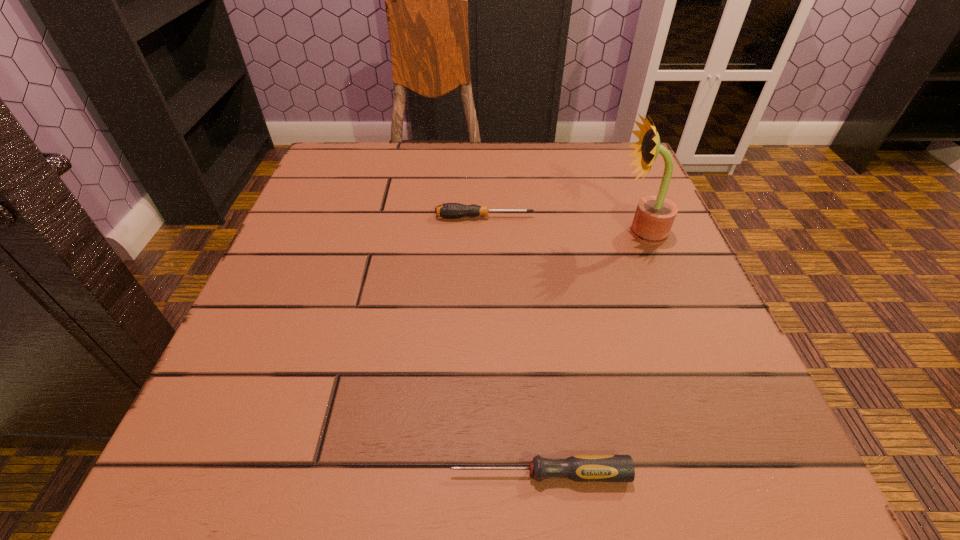
I want to click on object that is the second closest to the tallest object, so coord(581,468).